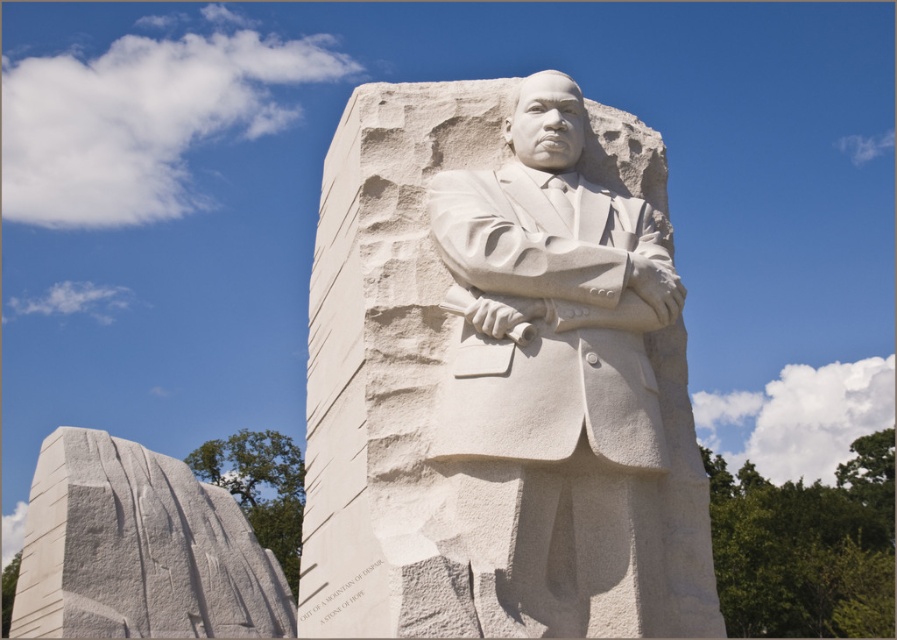
You are standing in front of the Martin Luther King Jr. sculpture and want to touch two specific points on the statue. The first point is at coordinate point [588,508] and the second is at point [114,627]. Which point will you reach first if you move towards them from your current position?

Point [588,508] is closer to the viewer than point [114,627], so you will reach point [588,508] first.

You are standing in front of the sculpture of Martin Luther King Jr. and notice a specific point at coordinates (560,381). What object is located at that point?

The point at coordinates (560,381) is where the white marble statue at center is located.